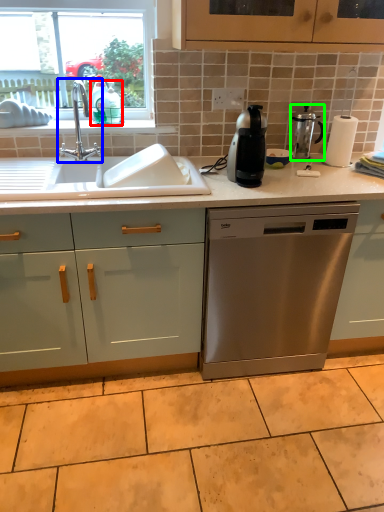
Question: Estimate the real-world distances between objects in this image. Which object is farther from teal (highlighted by a red box), tap (highlighted by a blue box) or kitchen appliance (highlighted by a green box)?

Choices:
 (A) tap
 (B) kitchen appliance

Answer: (B)